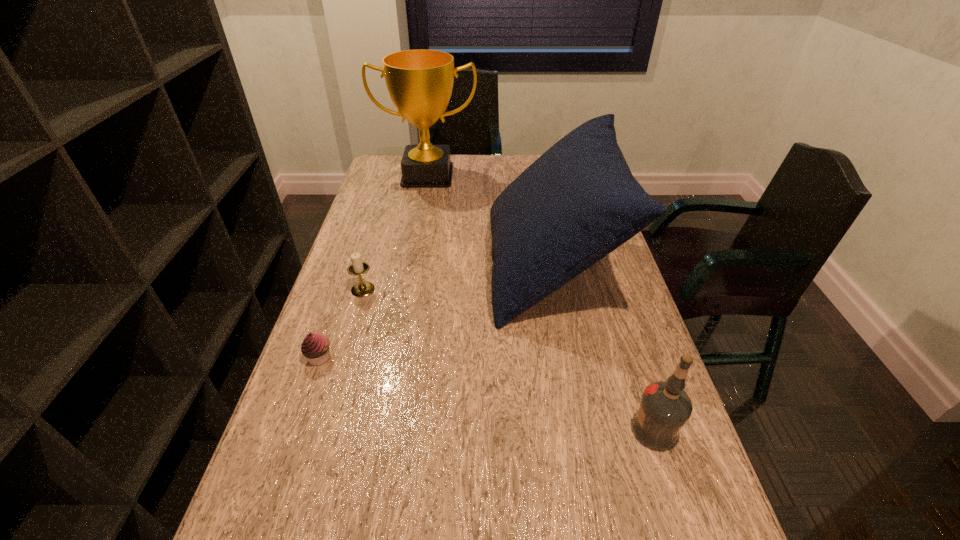
Where is `vacant space that's between the cupcake and the vodka`? vacant space that's between the cupcake and the vodka is located at coordinates (487, 394).

At what (x,y) coordinates should I click in order to perform the action: click on empty space that is in between the third tallest object and the shortest object. Please return your answer as a coordinate pair (x, y). The image size is (960, 540). Looking at the image, I should click on (487, 394).

The height and width of the screenshot is (540, 960). I want to click on free space between the cupcake and the award, so click(x=373, y=266).

The height and width of the screenshot is (540, 960). I want to click on vacant area that lies between the cushion and the second shortest object, so click(x=456, y=278).

This screenshot has height=540, width=960. I want to click on empty location between the second nearest object and the nearest object, so click(x=487, y=394).

Identify which object is the third closest to the vodka. Please provide its 2D coordinates. Your answer should be formatted as a tuple, i.e. [(x, y)], where the tuple contains the x and y coordinates of a point satisfying the conditions above.

[(364, 288)]

Where is `object that ranks as the third closest to the second nearest object`? This screenshot has height=540, width=960. object that ranks as the third closest to the second nearest object is located at coordinates pos(665,407).